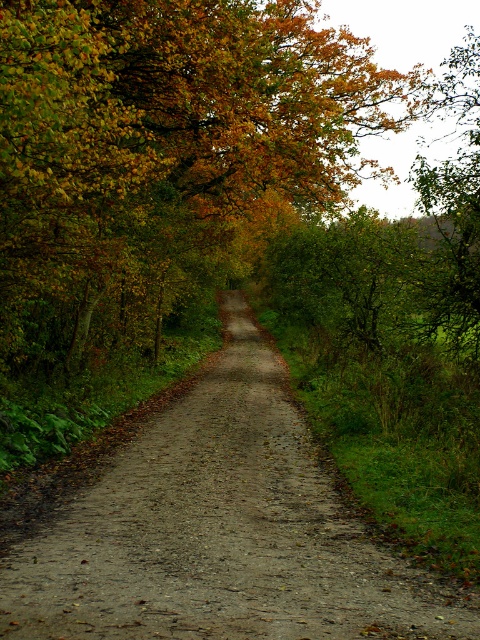
Question: Which point is farther to the camera?

Choices:
 (A) (177, 413)
 (B) (34, 298)

Answer: (A)

Question: Is yellow-green leaves at center further to the viewer compared to dull brown gravel at center?

Choices:
 (A) yes
 (B) no

Answer: (A)

Question: Is yellow-green leaves at center smaller than dull brown gravel at center?

Choices:
 (A) yes
 (B) no

Answer: (B)

Question: Does yellow-green leaves at center appear over dull brown gravel at center?

Choices:
 (A) yes
 (B) no

Answer: (A)